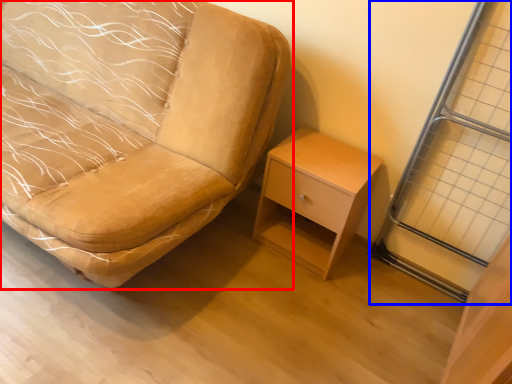
Question: Among these objects, which one is nearest to the camera, chair (highlighted by a red box) or screen door (highlighted by a blue box)?

Choices:
 (A) chair
 (B) screen door

Answer: (A)